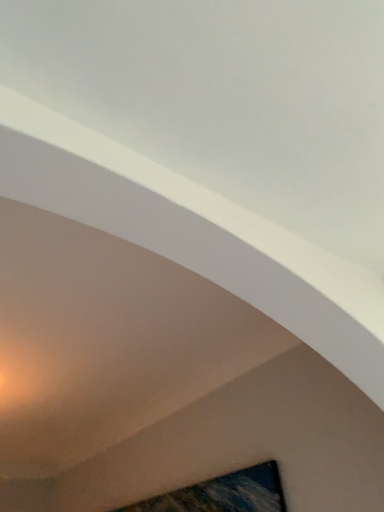
The height and width of the screenshot is (512, 384). What do you see at coordinates (223, 494) in the screenshot?
I see `wooden picture frame at lower center` at bounding box center [223, 494].

The image size is (384, 512). What are the coordinates of `wooden picture frame at lower center` in the screenshot? It's located at (223, 494).

I want to click on wooden picture frame at lower center, so click(223, 494).